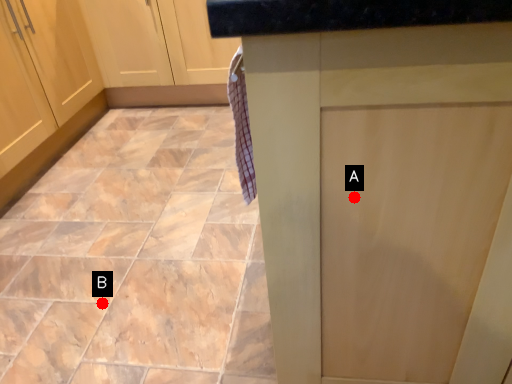
Question: Two points are circled on the image, labeled by A and B beside each circle. Which point is farther to the camera?

Choices:
 (A) A is further
 (B) B is further

Answer: (B)